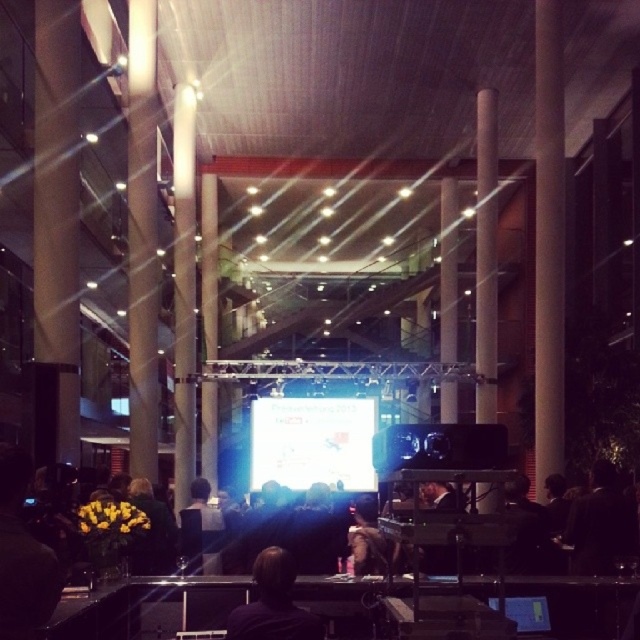
Is dark hair at lower right above dark hair at center?

Yes.

Can you confirm if dark hair at lower right is positioned to the left of dark hair at center?

No, dark hair at lower right is not to the left of dark hair at center.

Who is more forward, (564,528) or (205,540)?

Point (564,528)

Identify the location of dark hair at lower right. The height and width of the screenshot is (640, 640). (600, 524).

Based on the photo, how far apart are dark hair at left and dark hair at lower right?

A distance of 4.51 meters exists between dark hair at left and dark hair at lower right.

Is dark hair at left wider than dark hair at lower right?

In fact, dark hair at left might be narrower than dark hair at lower right.

The height and width of the screenshot is (640, 640). I want to click on dark hair at left, so click(x=22, y=556).

The image size is (640, 640). I want to click on dark hair at left, so click(x=22, y=556).

Which is more to the left, white glossy projection screen at center or dark hair at lower right?

white glossy projection screen at center is more to the left.

At what (x,y) coordinates should I click in order to perform the action: click on white glossy projection screen at center. Please return your answer as a coordinate pair (x, y). The width and height of the screenshot is (640, 640). Looking at the image, I should click on (312, 442).

What do you see at coordinates (312, 442) in the screenshot? The width and height of the screenshot is (640, 640). I see `white glossy projection screen at center` at bounding box center [312, 442].

This screenshot has width=640, height=640. I want to click on white glossy projection screen at center, so click(312, 442).